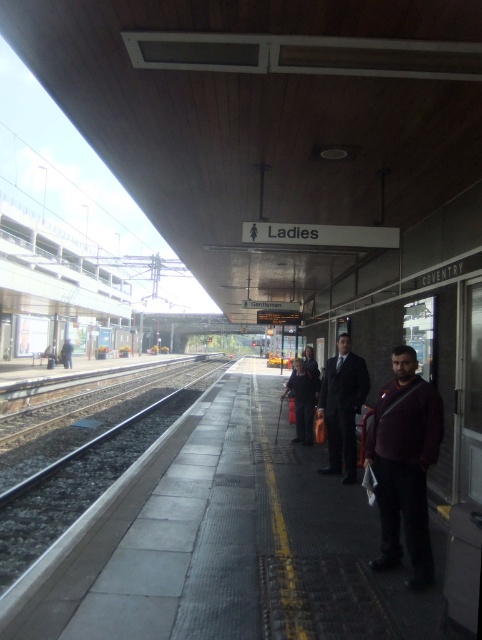
You are a commuter waiting on the train station platform. You notice a maroon fabric jacket at center and a dark suit at center. Which clothing item is wider?

The dark suit at center is wider than the maroon fabric jacket at center.

Looking at this image, you are a commuter waiting on the platform and see both the maroon fabric jacket at center and the dark suit at center. Which person is shorter?

The maroon fabric jacket at center is shorter than the dark suit at center.

Based on the photo, you are a commuter waiting on the platform and need to reach the restroom. You see the maroon fabric jacket at center and the dark suit at center. Which person is closer to you if you want to ask for directions?

The maroon fabric jacket at center is closer to the viewer than the dark suit at center, so you should ask the person wearing the maroon fabric jacket at center first.